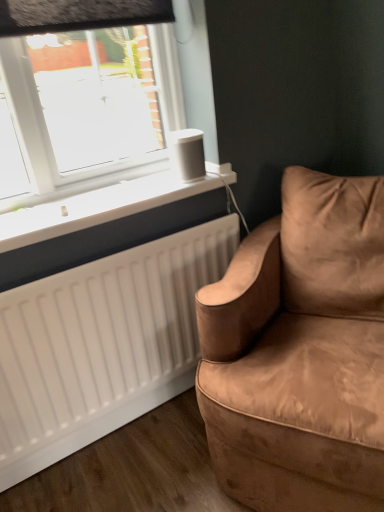
The width and height of the screenshot is (384, 512). What are the coordinates of `white matte speaker at upper center` in the screenshot? It's located at (188, 153).

This screenshot has width=384, height=512. Identify the location of suede brown couch at right. (300, 352).

In order to click on white matte speaker at upper center in this screenshot , I will do `click(188, 153)`.

Is point (169, 175) closer or farther from the camera than point (178, 140)?

Point (169, 175) is positioned farther from the camera compared to point (178, 140).

Based on the photo, which object is wider, white matte radiator at lower left or white matte speaker at upper center?

With larger width is white matte radiator at lower left.

Is white matte radiator at lower left looking in the opposite direction of white matte speaker at upper center?

No, white matte radiator at lower left is not facing away from white matte speaker at upper center.

Considering the sizes of objects suede brown couch at right and white matte speaker at upper center in the image provided, who is shorter, suede brown couch at right or white matte speaker at upper center?

white matte speaker at upper center.

Is suede brown couch at right far away from white matte speaker at upper center?

No.

In the image, is suede brown couch at right positioned in front of or behind white matte speaker at upper center?

In the image, suede brown couch at right appears in front of white matte speaker at upper center.

Would you say white matte speaker at upper center is inside or outside suede brown couch at right?

white matte speaker at upper center is outside suede brown couch at right.

From a real-world perspective, is white matte speaker at upper center located higher than suede brown couch at right?

Yes, from a real-world perspective, white matte speaker at upper center is on top of suede brown couch at right.

Locate an element on the screen. This screenshot has height=512, width=384. speaker above the suede brown couch at right (from a real-world perspective) is located at coordinates (188, 153).

Which object is further away from the camera, white matte speaker at upper center or suede brown couch at right?

white matte speaker at upper center is further away from the camera.

Which object is thinner, suede brown couch at right or white matte radiator at lower left?

With smaller width is white matte radiator at lower left.

Which is more to the left, suede brown couch at right or white matte radiator at lower left?

white matte radiator at lower left.

From the image's perspective, does suede brown couch at right appear higher than white matte radiator at lower left?

Incorrect, from the image's perspective, suede brown couch at right is lower than white matte radiator at lower left.

From the image's perspective, is white matte radiator at lower left above or below suede brown couch at right?

white matte radiator at lower left is situated higher than suede brown couch at right in the image.

Is the depth of white matte radiator at lower left greater than that of suede brown couch at right?

Yes, white matte radiator at lower left is further from the viewer.

I want to click on window sill behind the suede brown couch at right, so click(97, 208).

Is point (178, 141) positioned behind point (139, 210)?

Yes, it is.

The width and height of the screenshot is (384, 512). I want to click on speaker above the white matte radiator at lower left (from the image's perspective), so click(188, 153).

Which object is wider, white matte speaker at upper center or white matte radiator at lower left?

white matte radiator at lower left is wider.

Can you confirm if white matte speaker at upper center is positioned to the right of white matte radiator at lower left?

Yes, white matte speaker at upper center is to the right of white matte radiator at lower left.

Locate an element on the screen. The width and height of the screenshot is (384, 512). window sill located below the white matte speaker at upper center (from the image's perspective) is located at coordinates (97, 208).

Find the location of `speaker lying on the left of suede brown couch at right`. speaker lying on the left of suede brown couch at right is located at coordinates (188, 153).

Based on their spatial positions, is suede brown couch at right or white matte speaker at upper center closer to white matte radiator at lower left?

Among the two, white matte speaker at upper center is located nearer to white matte radiator at lower left.

Which object lies further to the anchor point white matte radiator at lower left, white matte speaker at upper center or suede brown couch at right?

Among the two, suede brown couch at right is located further to white matte radiator at lower left.

When comparing their distances from suede brown couch at right, does white matte speaker at upper center or white matte radiator at lower left seem further?

white matte speaker at upper center is further to suede brown couch at right.

Looking at this image, looking at the image, which one is located closer to suede brown couch at right, white matte radiator at lower left or white matte speaker at upper center?

Among the two, white matte radiator at lower left is located nearer to suede brown couch at right.

Based on their spatial positions, is suede brown couch at right or white matte radiator at lower left further from white matte speaker at upper center?

suede brown couch at right lies further to white matte speaker at upper center than the other object.

Estimate the real-world distances between objects in this image. Which object is further from white matte speaker at upper center, white matte radiator at lower left or suede brown couch at right?

suede brown couch at right is further to white matte speaker at upper center.

Locate an element on the screen. The width and height of the screenshot is (384, 512). window sill between suede brown couch at right and white matte speaker at upper center along the z-axis is located at coordinates (97, 208).